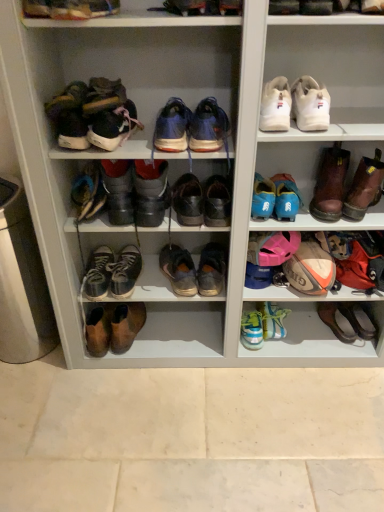
The width and height of the screenshot is (384, 512). What are the coordinates of `free space in front of light blue fabric sneaker at lower center, arranged as the first shoe when viewed from the right` in the screenshot? It's located at (288, 353).